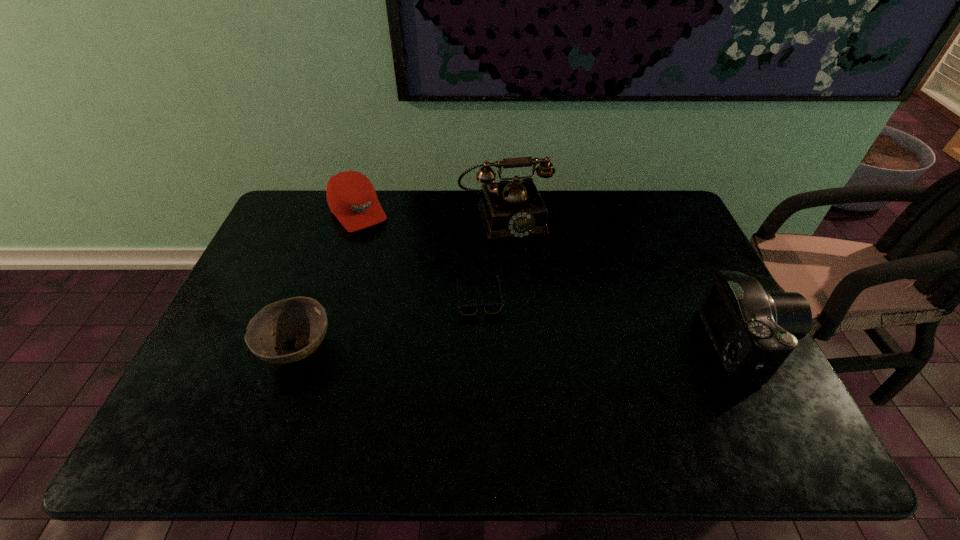
This screenshot has width=960, height=540. I want to click on blank area located on the front-facing side of the cap, so click(x=403, y=273).

This screenshot has width=960, height=540. I want to click on free space located 0.290m on the front-facing side of the cap, so click(411, 284).

What are the coordinates of `free space located on the front-facing side of the cap` in the screenshot? It's located at (408, 279).

Find the location of `vacant space located on the lenses of the sunglasses`. vacant space located on the lenses of the sunglasses is located at coordinates (510, 333).

The height and width of the screenshot is (540, 960). I want to click on vacant space located on the lenses of the sunglasses, so (x=551, y=381).

The image size is (960, 540). I want to click on free space located 0.210m on the lenses of the sunglasses, so click(540, 369).

Find the location of `telephone that is positioned at the far edge`. telephone that is positioned at the far edge is located at coordinates (509, 209).

At what (x,y) coordinates should I click in order to perform the action: click on cap present at the far edge. Please return your answer as a coordinate pair (x, y). Looking at the image, I should click on (351, 197).

At what (x,y) coordinates should I click in order to perform the action: click on bowl located in the near edge section of the desktop. Please return your answer as a coordinate pair (x, y). This screenshot has width=960, height=540. Looking at the image, I should click on (304, 318).

Find the location of a particular element. camera that is at the near edge is located at coordinates (754, 331).